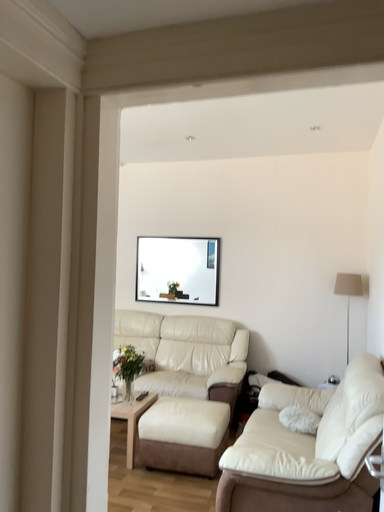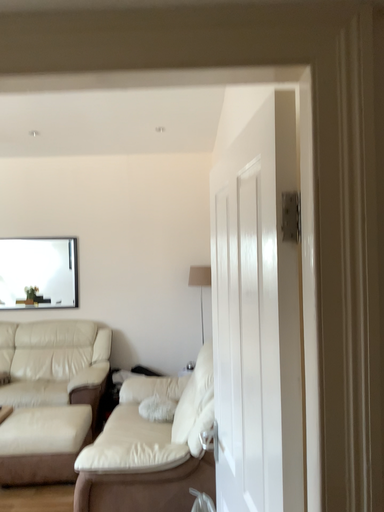
Question: Which way did the camera rotate in the video?

Choices:
 (A) rotated right
 (B) rotated left

Answer: (A)